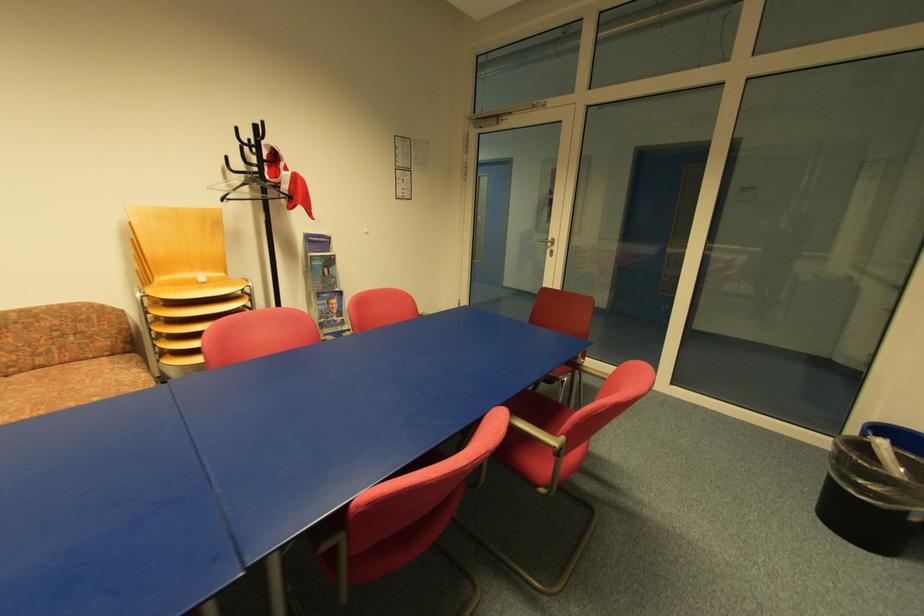
The width and height of the screenshot is (924, 616). Describe the element at coordinates (251, 132) in the screenshot. I see `the black coat rack hook` at that location.